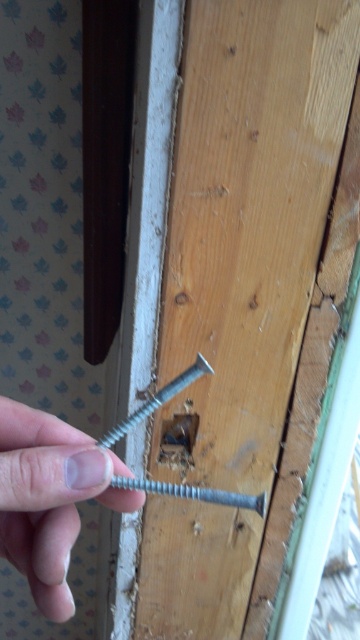
You are looking at the image of a wooden surface with a screw being inserted. Where is the pale skin at center located in the image?

The pale skin at center is located at the coordinates point (50, 497).

You are trying to determine if the pale skin at center can fit through a narrow opening that the silver metallic bolt at center currently occupies. Based on their widths, which object is wider?

The pale skin at center is wider than the silver metallic bolt at center, so it cannot fit through the bolt occupied space.